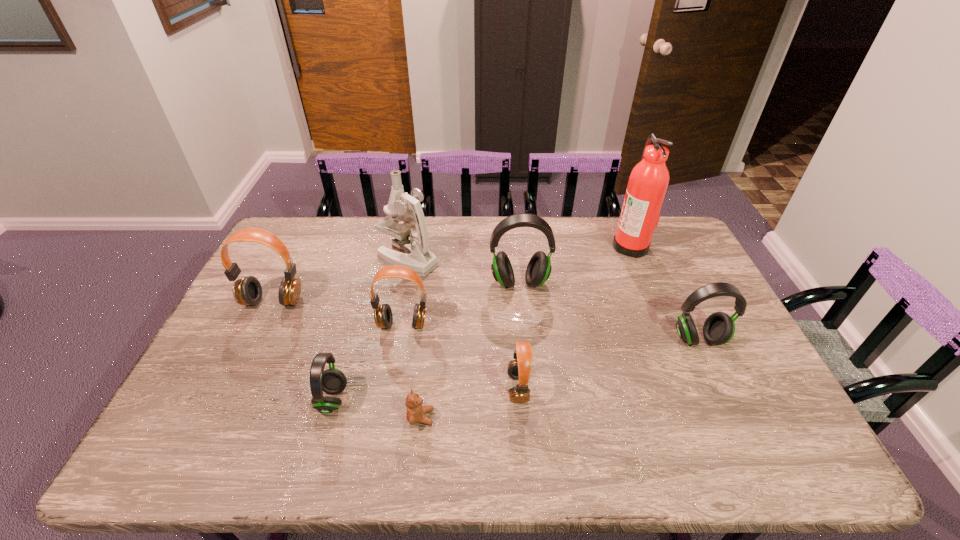
The image size is (960, 540). What are the coordinates of `fire extinguisher situated at the far edge` in the screenshot? It's located at (649, 179).

You are a GUI agent. You are given a task and a screenshot of the screen. Output one action in this format:
    pyautogui.click(x=<x>, y=<y>)
    Task: Click on the microscope that is at the far edge
    
    Given the screenshot: What is the action you would take?
    pyautogui.click(x=416, y=255)

At what (x,y) coordinates should I click in order to perform the action: click on object at the left edge. Please return your answer as a coordinate pair (x, y). The height and width of the screenshot is (540, 960). Looking at the image, I should click on click(247, 291).

Identify the location of fire extinguisher located at the right edge. The image size is (960, 540). (649, 179).

This screenshot has width=960, height=540. In order to click on headset that is at the right edge in this screenshot , I will do `click(719, 328)`.

The height and width of the screenshot is (540, 960). I want to click on object located in the far right corner section of the desktop, so click(x=649, y=179).

The height and width of the screenshot is (540, 960). In order to click on vacant point at the far edge in this screenshot , I will do `click(378, 237)`.

Find the location of `blank space at the near edge`. blank space at the near edge is located at coordinates (644, 446).

Where is `vacant region at the left edge`? vacant region at the left edge is located at coordinates (269, 326).

Find the location of a particular element. vacant space at the right edge of the desktop is located at coordinates (745, 385).